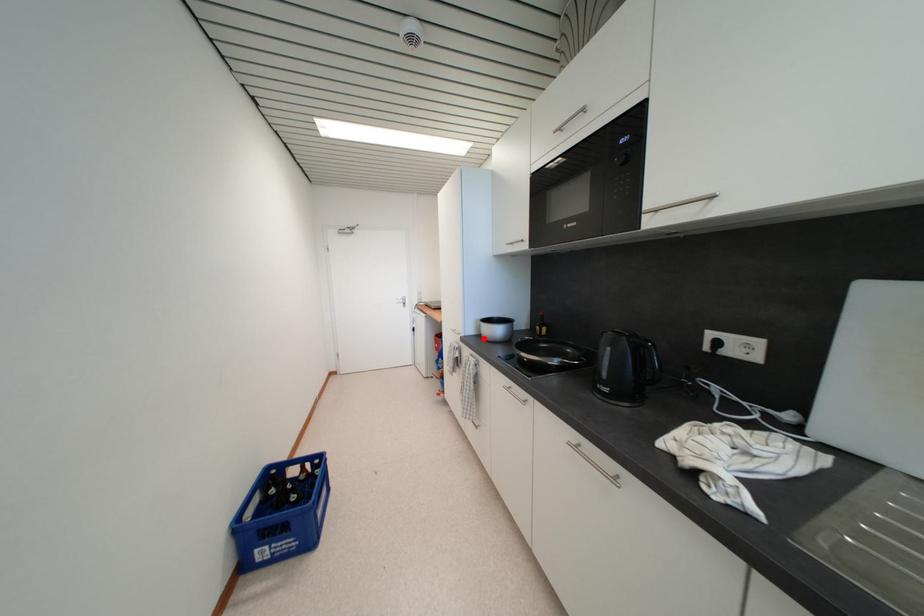
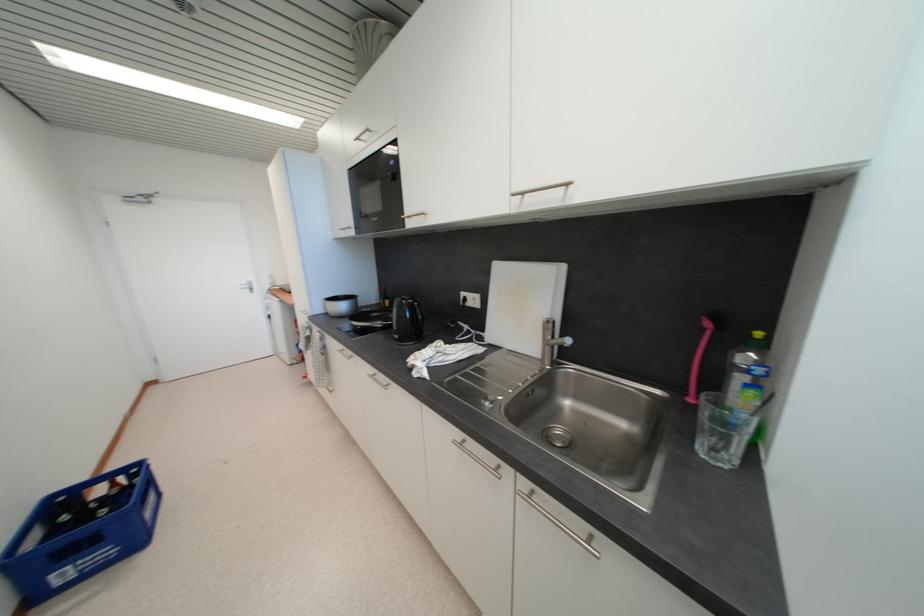
Find the pixel in the second image that matches the highlighted location in the first image.

(332, 315)